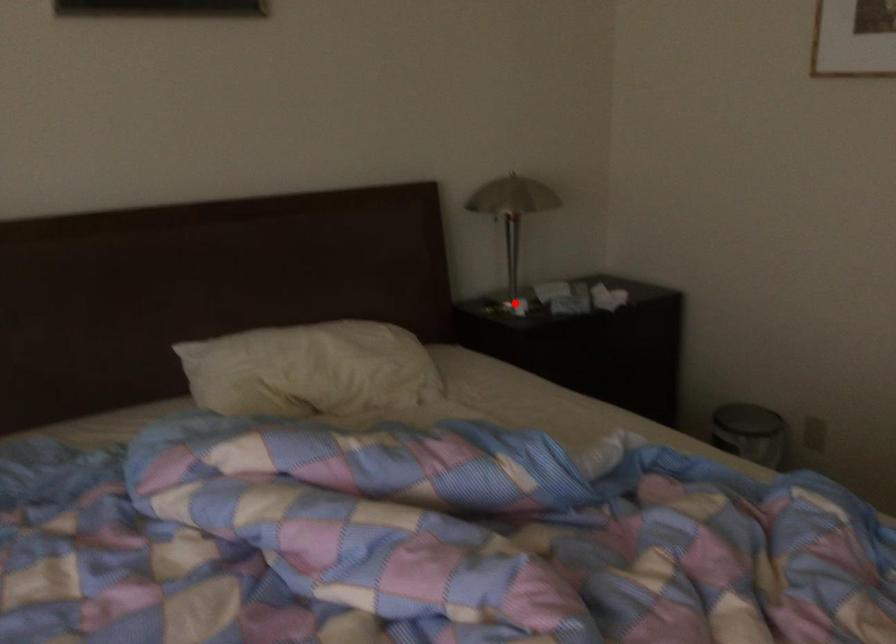
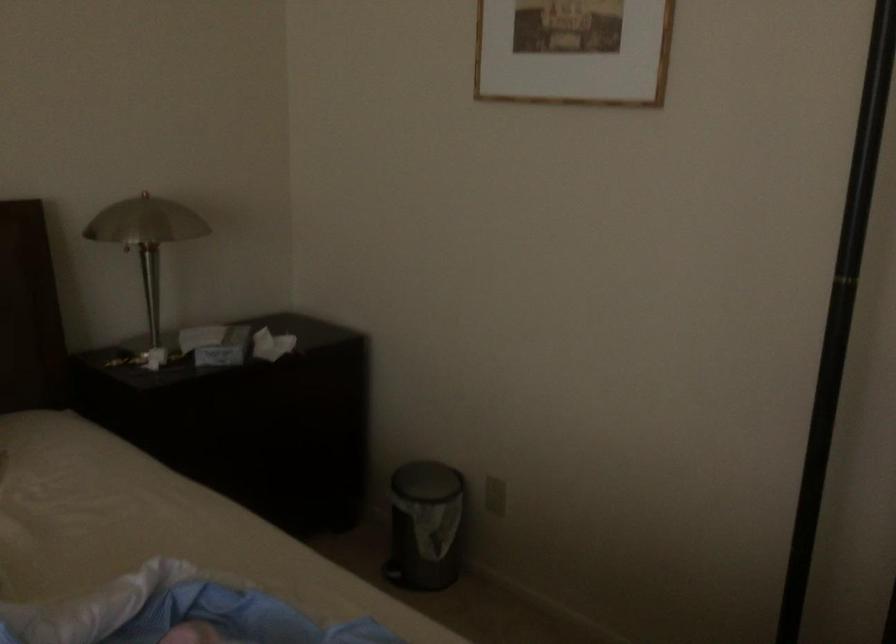
The point at the highlighted location is marked in the first image. Where is the corresponding point in the second image?

(151, 357)